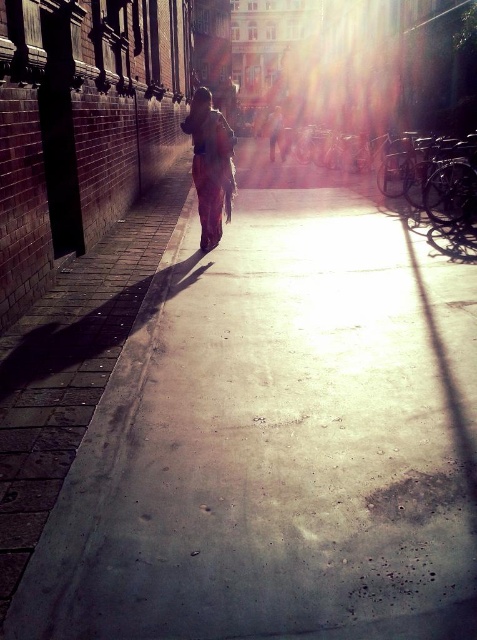
Question: Can you confirm if matte orange pants at center is positioned below light brown leather jacket at center?

Choices:
 (A) yes
 (B) no

Answer: (A)

Question: Which point is farther from the camera taking this photo?

Choices:
 (A) (280, 144)
 (B) (186, 122)

Answer: (A)

Question: Does matte orange pants at center appear on the right side of light brown leather jacket at center?

Choices:
 (A) no
 (B) yes

Answer: (A)

Question: Which point is farther to the camera?

Choices:
 (A) matte orange pants at center
 (B) light brown leather jacket at center

Answer: (B)

Question: Does matte orange pants at center come behind light brown leather jacket at center?

Choices:
 (A) no
 (B) yes

Answer: (A)